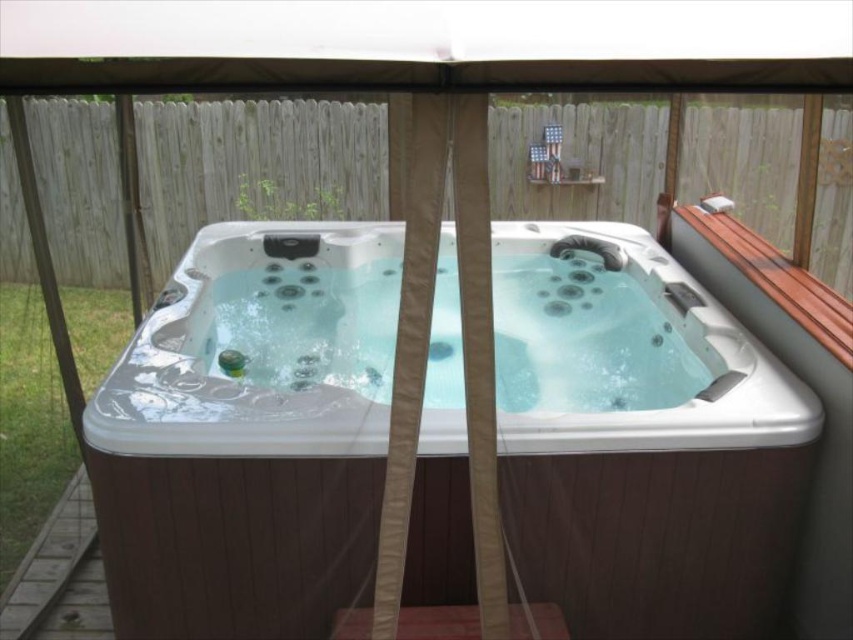
Locate an element on the screen. The image size is (853, 640). white glossy hot tub at center is located at coordinates (248, 435).

Between white glossy hot tub at center and brown wooden deck at lower left, which one appears on the right side from the viewer's perspective?

white glossy hot tub at center is more to the right.

Is point (117, 442) less distant than point (32, 560)?

Yes, it is.

You are a GUI agent. You are given a task and a screenshot of the screen. Output one action in this format:
    pyautogui.click(x=<x>, y=<y>)
    Task: Click on the white glossy hot tub at center
    The image size is (853, 640).
    Given the screenshot: What is the action you would take?
    pyautogui.click(x=248, y=435)